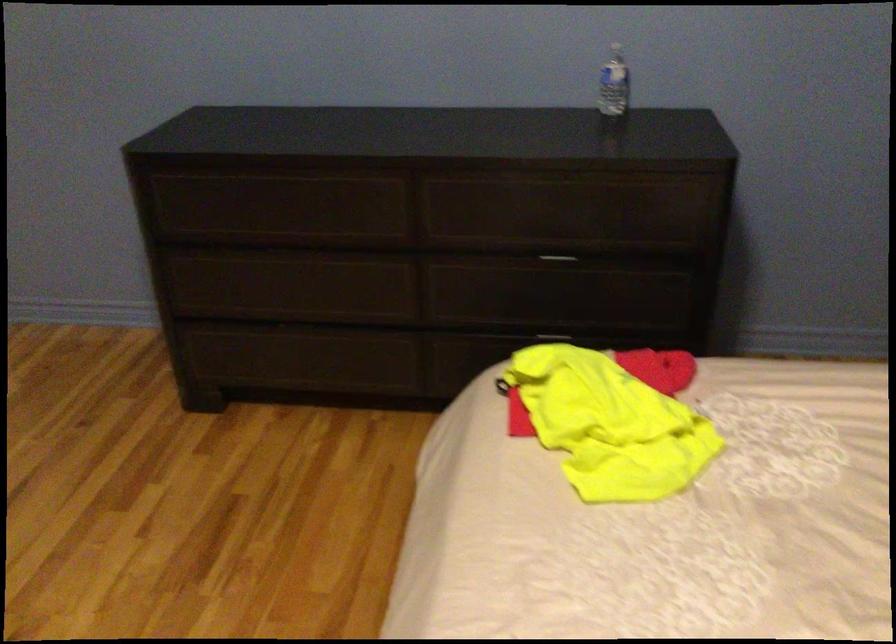
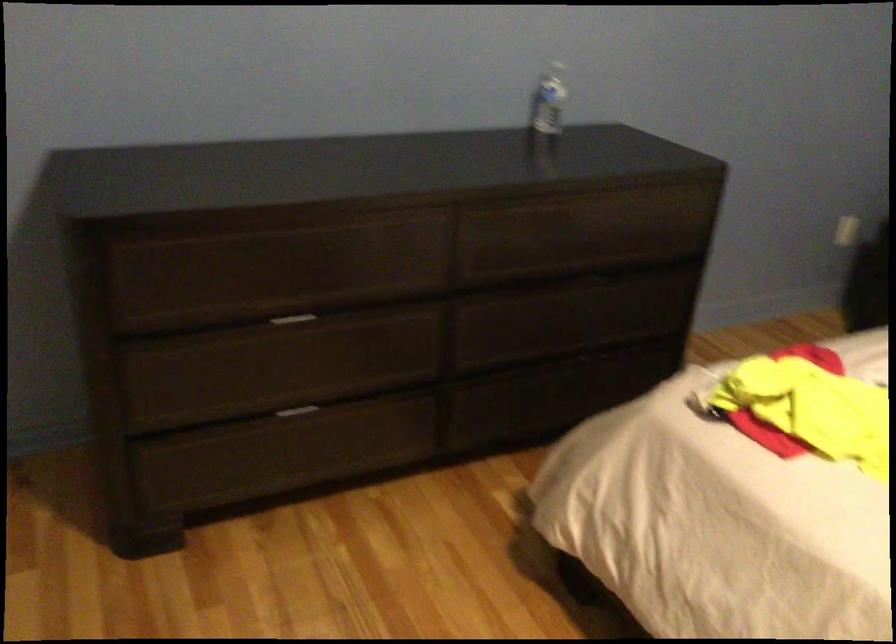
Find the pixel in the second image that matches (605,88) in the first image.

(548, 100)